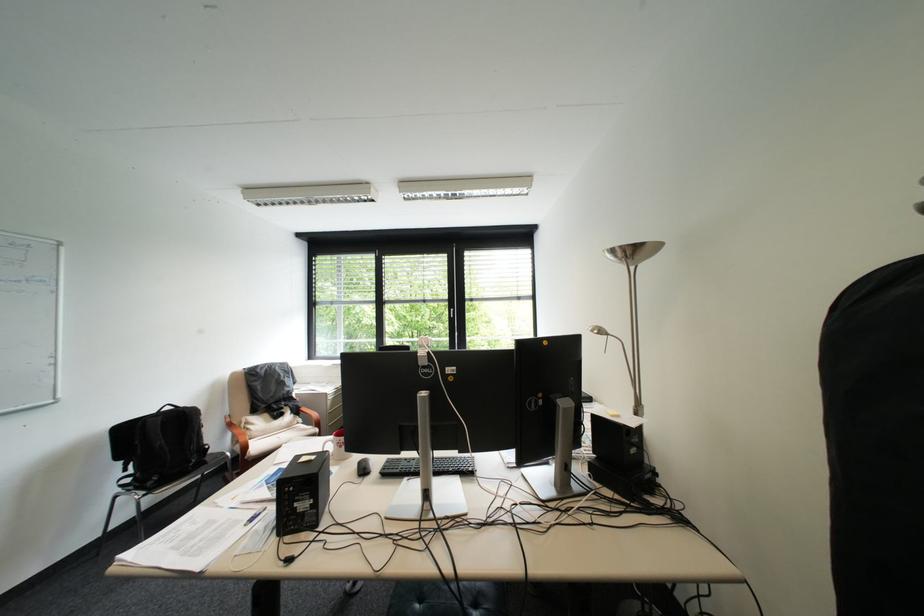
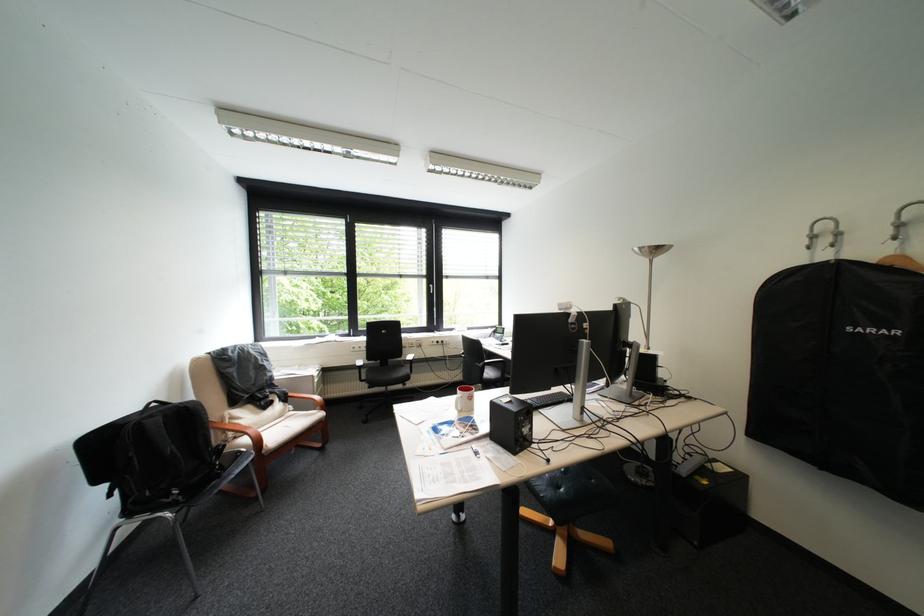
Where in the second image is the point corresponding to [257,448] from the first image?

(271, 443)